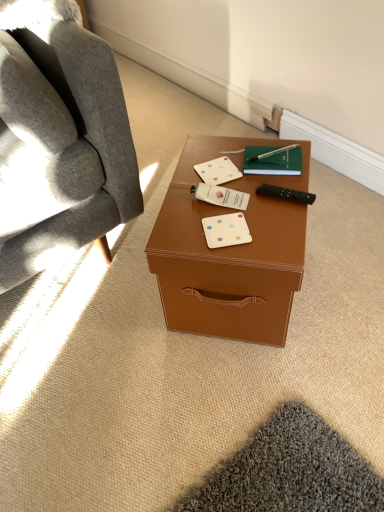
I want to click on free region on the left part of brown leather desk at center, so click(101, 314).